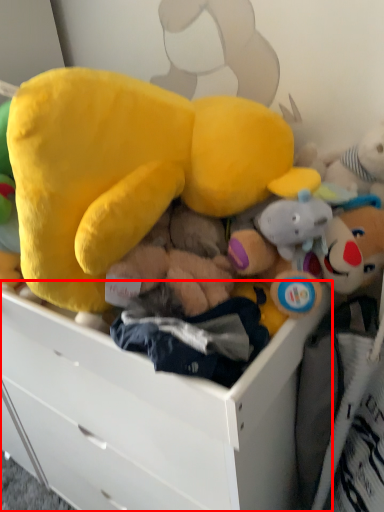
Question: Where is drawer (annotated by the red box) located in relation to toy in the image?

Choices:
 (A) right
 (B) left

Answer: (A)